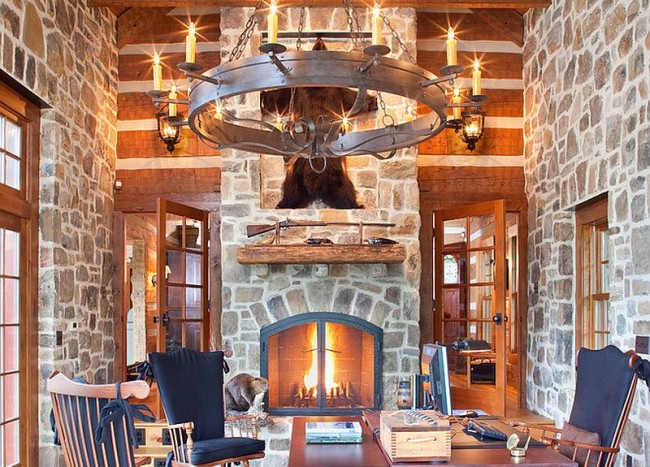
In order to click on wooden chairs with blue cushions in this screenshot , I will do `click(184, 382)`, `click(603, 382)`.